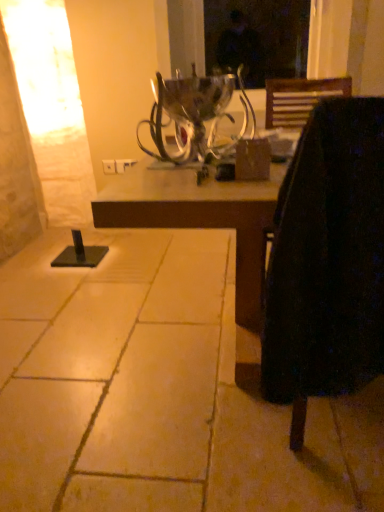
Question: Should I look upward or downward to see black fabric chair at right?

Choices:
 (A) down
 (B) up

Answer: (B)

Question: Does metallic silver candle holder at center appear on the left side of brown tile floor at lower left?

Choices:
 (A) yes
 (B) no

Answer: (B)

Question: Considering the relative sizes of metallic silver candle holder at center and brown tile floor at lower left in the image provided, is metallic silver candle holder at center smaller than brown tile floor at lower left?

Choices:
 (A) yes
 (B) no

Answer: (A)

Question: Is metallic silver candle holder at center not inside brown tile floor at lower left?

Choices:
 (A) yes
 (B) no

Answer: (A)

Question: From a real-world perspective, is metallic silver candle holder at center beneath brown tile floor at lower left?

Choices:
 (A) no
 (B) yes

Answer: (A)

Question: From the image's perspective, is metallic silver candle holder at center above brown tile floor at lower left?

Choices:
 (A) yes
 (B) no

Answer: (A)

Question: From the image's perspective, is metallic silver candle holder at center under brown tile floor at lower left?

Choices:
 (A) no
 (B) yes

Answer: (A)

Question: Does metallic silver candle holder at center lie behind matte brown table at center?

Choices:
 (A) yes
 (B) no

Answer: (A)

Question: Does metallic silver candle holder at center have a greater height compared to matte brown table at center?

Choices:
 (A) yes
 (B) no

Answer: (B)

Question: Can you confirm if metallic silver candle holder at center is wider than matte brown table at center?

Choices:
 (A) yes
 (B) no

Answer: (B)

Question: From a real-world perspective, is metallic silver candle holder at center over matte brown table at center?

Choices:
 (A) no
 (B) yes

Answer: (B)

Question: Is metallic silver candle holder at center placed right next to matte brown table at center?

Choices:
 (A) no
 (B) yes

Answer: (A)

Question: Can you confirm if metallic silver candle holder at center is positioned to the left of matte brown table at center?

Choices:
 (A) yes
 (B) no

Answer: (A)

Question: Does black fabric chair at right have a larger size compared to metallic silver candle holder at center?

Choices:
 (A) no
 (B) yes

Answer: (B)